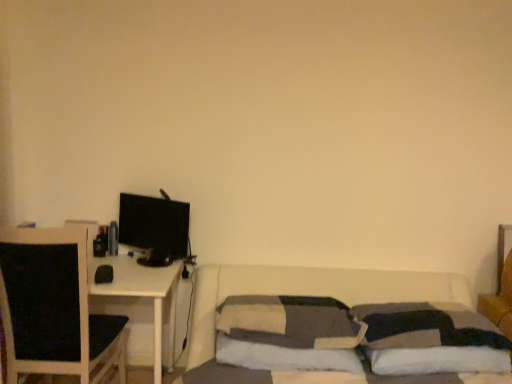
The width and height of the screenshot is (512, 384). What are the coordinates of `empty space that is ontop of textured gray pillow at center, arranged as the 3th pillow when viewed from the right (from a real-world perspective)` in the screenshot? It's located at (290, 302).